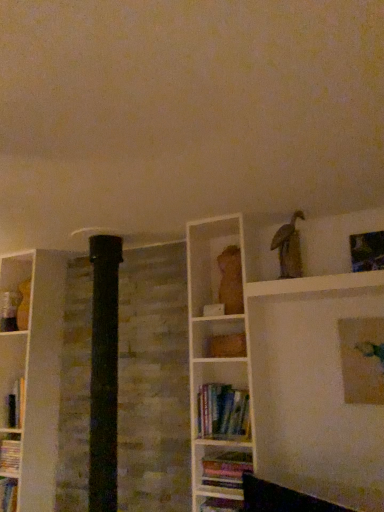
Question: Is matte gold picture frame at upper right, placed as the 1th picture frame when sorted from bottom to top, beside metallic silver picture frame at upper right, which appears as the 1th picture frame when viewed from the top?

Choices:
 (A) yes
 (B) no

Answer: (B)

Question: Is matte gold picture frame at upper right, placed as the 1th picture frame when sorted from bottom to top, not within metallic silver picture frame at upper right, which appears as the 1th picture frame when viewed from the top?

Choices:
 (A) no
 (B) yes

Answer: (B)

Question: Is matte gold picture frame at upper right, placed as the 1th picture frame when sorted from bottom to top, to the left of metallic silver picture frame at upper right, which is the second picture frame in bottom-to-top order, from the viewer's perspective?

Choices:
 (A) yes
 (B) no

Answer: (A)

Question: From a real-world perspective, is matte gold picture frame at upper right, the 2th picture frame from the top, positioned over metallic silver picture frame at upper right, which appears as the 1th picture frame when viewed from the top, based on gravity?

Choices:
 (A) no
 (B) yes

Answer: (A)

Question: Is matte gold picture frame at upper right, placed as the 1th picture frame when sorted from bottom to top, shorter than metallic silver picture frame at upper right, which appears as the 1th picture frame when viewed from the top?

Choices:
 (A) no
 (B) yes

Answer: (A)

Question: From the image's perspective, is matte gold picture frame at upper right, the 2th picture frame from the top, on metallic silver picture frame at upper right, which appears as the 1th picture frame when viewed from the top?

Choices:
 (A) yes
 (B) no

Answer: (B)

Question: Considering the relative positions of metallic silver picture frame at upper right, which appears as the 1th picture frame when viewed from the top, and matte gold picture frame at upper right, placed as the 1th picture frame when sorted from bottom to top, in the image provided, is metallic silver picture frame at upper right, which appears as the 1th picture frame when viewed from the top, in front of matte gold picture frame at upper right, placed as the 1th picture frame when sorted from bottom to top,?

Choices:
 (A) no
 (B) yes

Answer: (A)

Question: From the image's perspective, is metallic silver picture frame at upper right, which appears as the 1th picture frame when viewed from the top, above matte gold picture frame at upper right, the 2th picture frame from the top?

Choices:
 (A) no
 (B) yes

Answer: (B)

Question: Can matte gold picture frame at upper right, placed as the 1th picture frame when sorted from bottom to top, be found inside metallic silver picture frame at upper right, which appears as the 1th picture frame when viewed from the top?

Choices:
 (A) yes
 (B) no

Answer: (B)

Question: Does metallic silver picture frame at upper right, which appears as the 1th picture frame when viewed from the top, have a greater width compared to matte gold picture frame at upper right, the 2th picture frame from the top?

Choices:
 (A) yes
 (B) no

Answer: (A)

Question: Does metallic silver picture frame at upper right, which appears as the 1th picture frame when viewed from the top, touch matte gold picture frame at upper right, the 2th picture frame from the top?

Choices:
 (A) yes
 (B) no

Answer: (B)

Question: Is metallic silver picture frame at upper right, which appears as the 1th picture frame when viewed from the top, located outside matte gold picture frame at upper right, placed as the 1th picture frame when sorted from bottom to top?

Choices:
 (A) yes
 (B) no

Answer: (A)

Question: Is matte gold picture frame at upper right, placed as the 1th picture frame when sorted from bottom to top, taller than hardcover books at center, the second book when ordered from bottom to top?

Choices:
 (A) yes
 (B) no

Answer: (A)